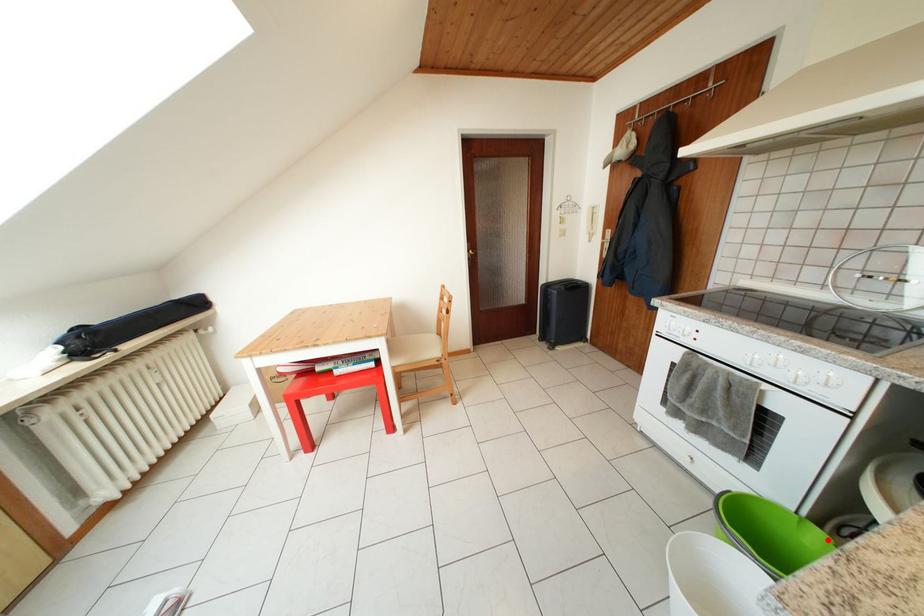
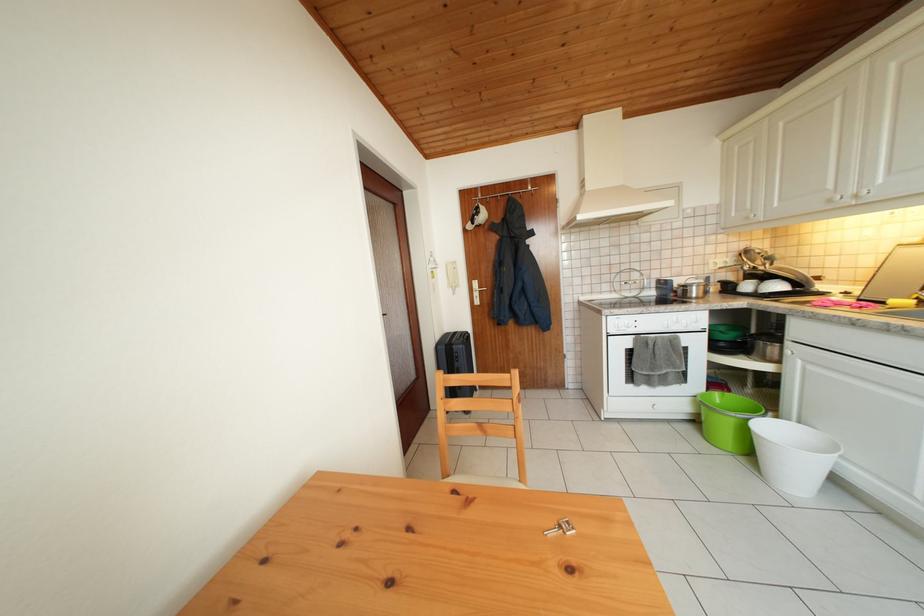
In the second image, find the point that corresponds to the highlighted location in the first image.

(724, 399)